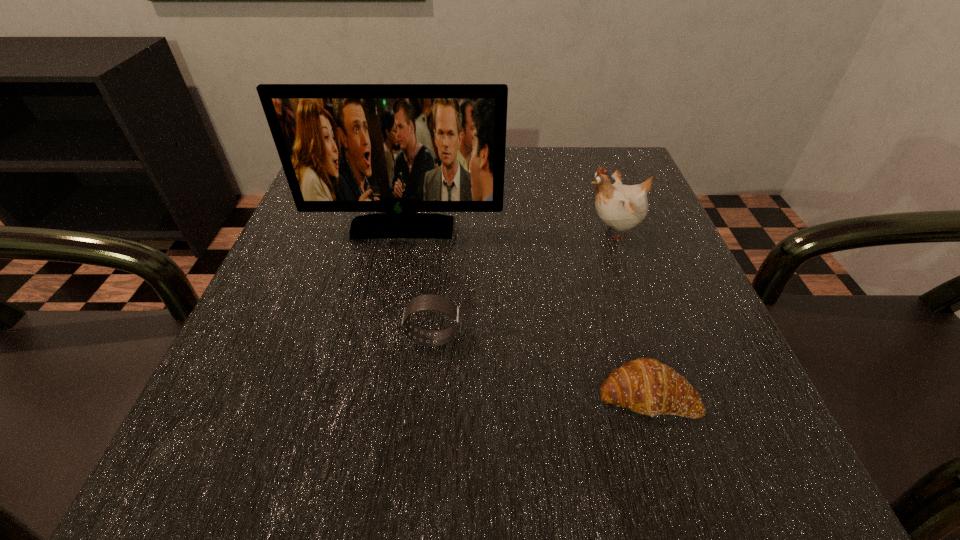
Image resolution: width=960 pixels, height=540 pixels. Find the location of `monitor`. monitor is located at coordinates (399, 149).

The image size is (960, 540). Identify the location of bird. (x=622, y=207).

At what (x,y) coordinates should I click in order to perform the action: click on the second shortest object. Please return your answer as a coordinate pair (x, y). Looking at the image, I should click on (434, 302).

The width and height of the screenshot is (960, 540). Find the location of `the third farthest object`. the third farthest object is located at coordinates (434, 302).

At what (x,y) coordinates should I click in order to perform the action: click on crescent roll. Please return your answer as a coordinate pair (x, y). Looking at the image, I should click on (646, 386).

Find the location of a particular element. The width and height of the screenshot is (960, 540). the nearest object is located at coordinates (646, 386).

At what (x,y) coordinates should I click in order to perform the action: click on vacant space located 0.390m on the front-facing side of the monitor. Please return your answer as a coordinate pair (x, y). This screenshot has width=960, height=540. Looking at the image, I should click on (361, 434).

I want to click on free space located at the beak of the bird, so click(478, 232).

Where is `vacant space situated 0.370m at the beak of the bird`? The height and width of the screenshot is (540, 960). vacant space situated 0.370m at the beak of the bird is located at coordinates (391, 232).

This screenshot has height=540, width=960. What are the coordinates of `free location located 0.370m at the beak of the bird` in the screenshot? It's located at (391, 232).